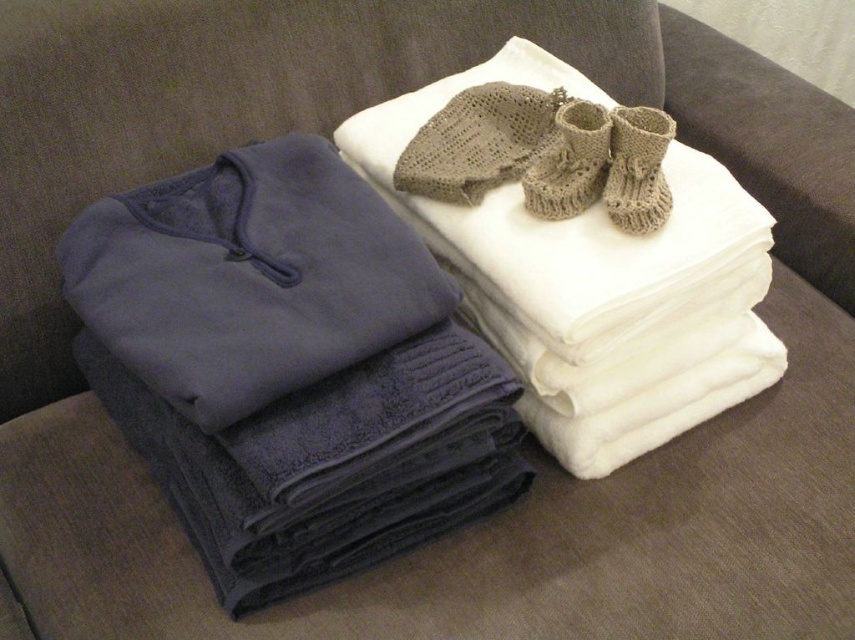
You are a delivery person trying to place a small package between the knitted beige booties at upper center and the knitted beige booties at upper right on the couch. The package is 1.5 inches wide. Can you fit it between them?

The distance between the knitted beige booties at upper center and the knitted beige booties at upper right is 1.71 inches. Since the package is 1.5 inches wide, it can fit between them as there is enough space.

You are organizing a baby shower gift basket and need to place the navy fleece sweater at left into the basket. The basket is located at point (249, 276). Is the navy fleece sweater at left already at the basket location?

Yes, the navy fleece sweater at left is already located at point (249, 276).